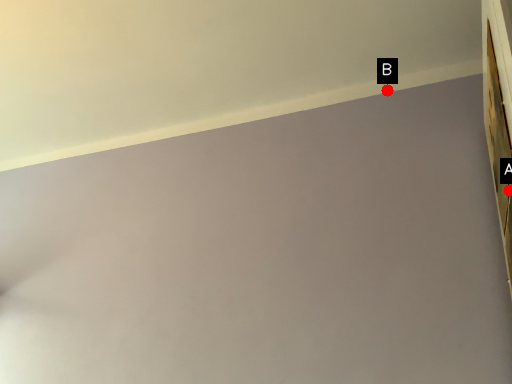
Question: Two points are circled on the image, labeled by A and B beside each circle. Which point appears farthest from the camera in this image?

Choices:
 (A) A is further
 (B) B is further

Answer: (B)